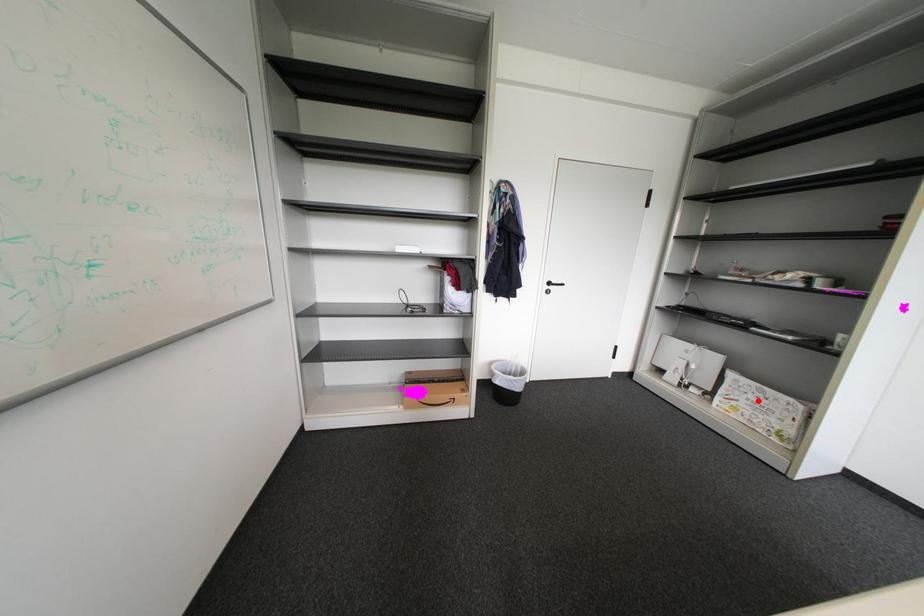
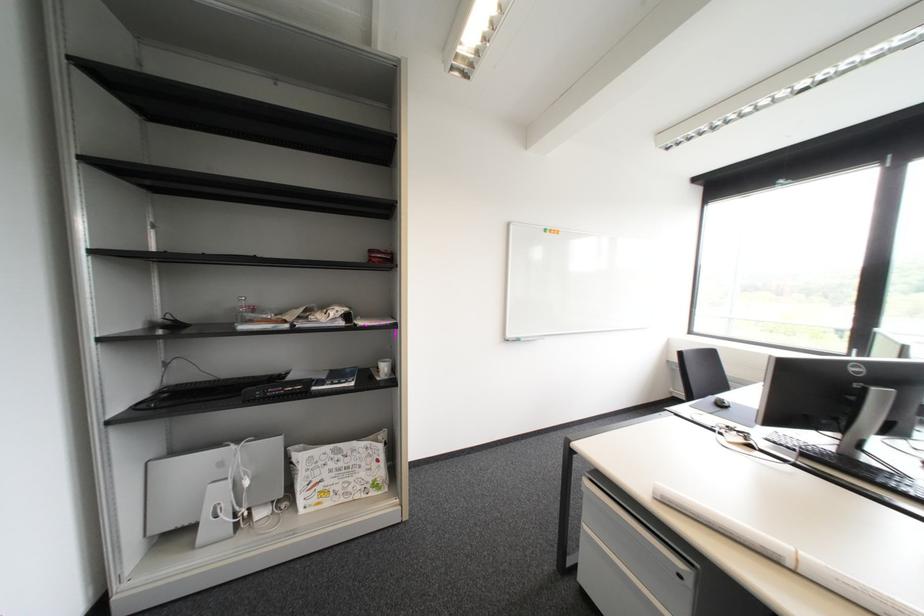
Question: I am providing you with two images of the same scene from different viewpoints. In image1, a red point is highlighted. Considering the same 3D point in image2, which of the following is correct?

Choices:
 (A) It is closer
 (B) It is farther

Answer: (B)